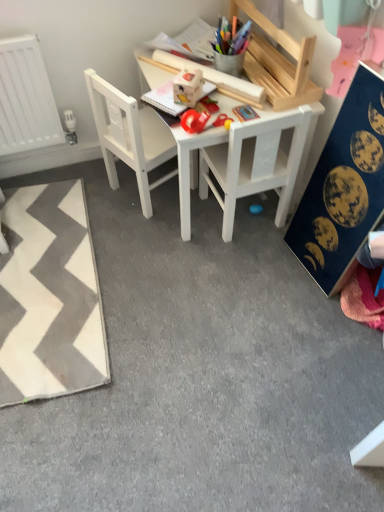
Image resolution: width=384 pixels, height=512 pixels. I want to click on vacant area in front of dark blue fabric with celestial prints at right, so click(x=302, y=317).